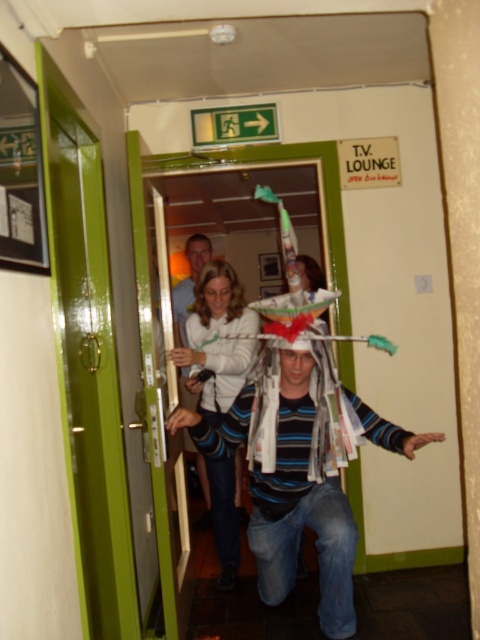
Question: Which point is closer to the camera?

Choices:
 (A) (231, 474)
 (B) (192, 246)

Answer: (A)

Question: In this image, where is white fabric at center located relative to striped cotton shirt at center?

Choices:
 (A) below
 (B) above

Answer: (A)

Question: Which point appears farthest from the camera in this image?

Choices:
 (A) (224, 282)
 (B) (196, 241)

Answer: (B)

Question: Can you confirm if white fabric at center is positioned to the right of striped cotton shirt at center?

Choices:
 (A) no
 (B) yes

Answer: (B)

Question: Is white fabric at center bigger than striped cotton shirt at center?

Choices:
 (A) no
 (B) yes

Answer: (A)